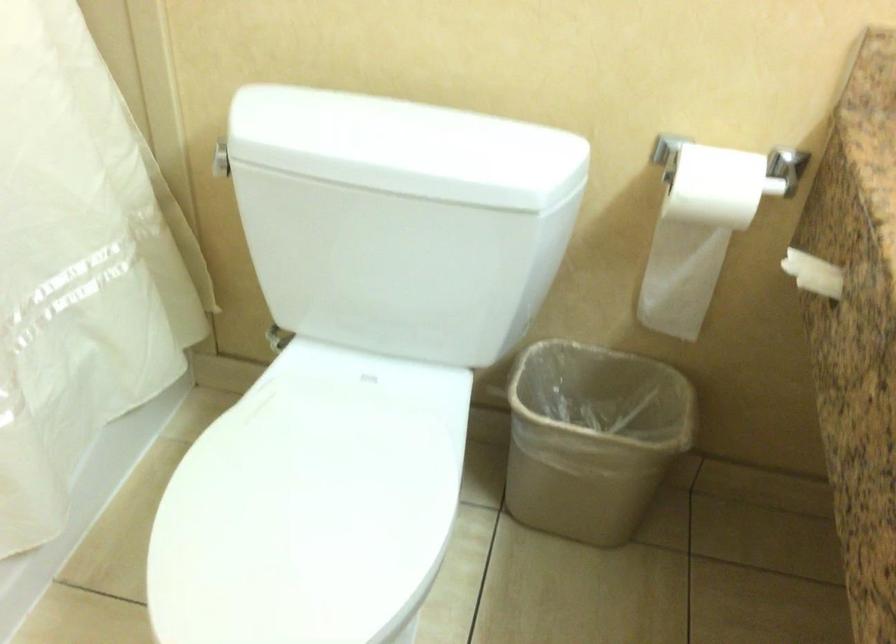
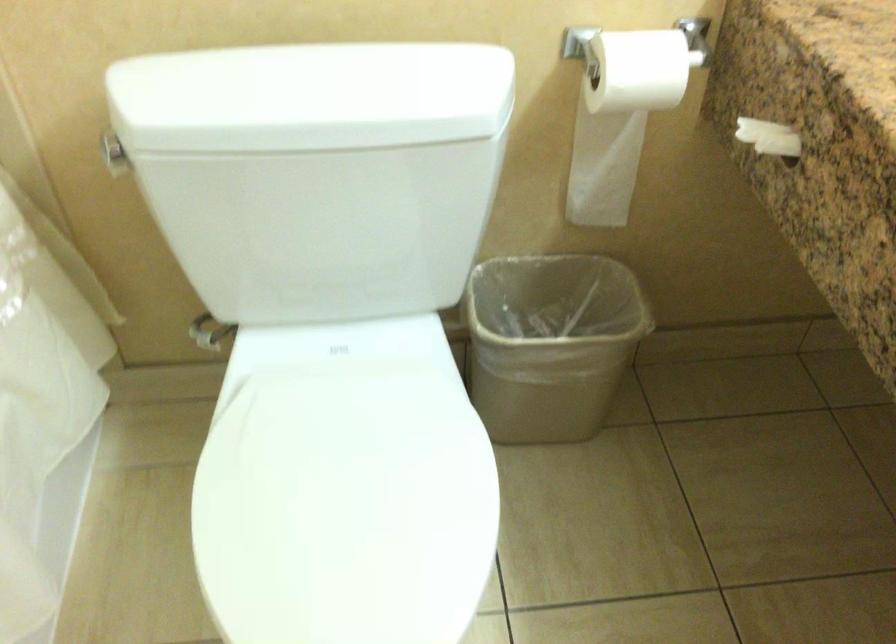
Question: The camera is either moving clockwise (left) or counter-clockwise (right) around the object. The first image is from the beginning of the video and the second image is from the end. Is the camera moving left or right when shooting the video?

Choices:
 (A) Left
 (B) Right

Answer: (A)